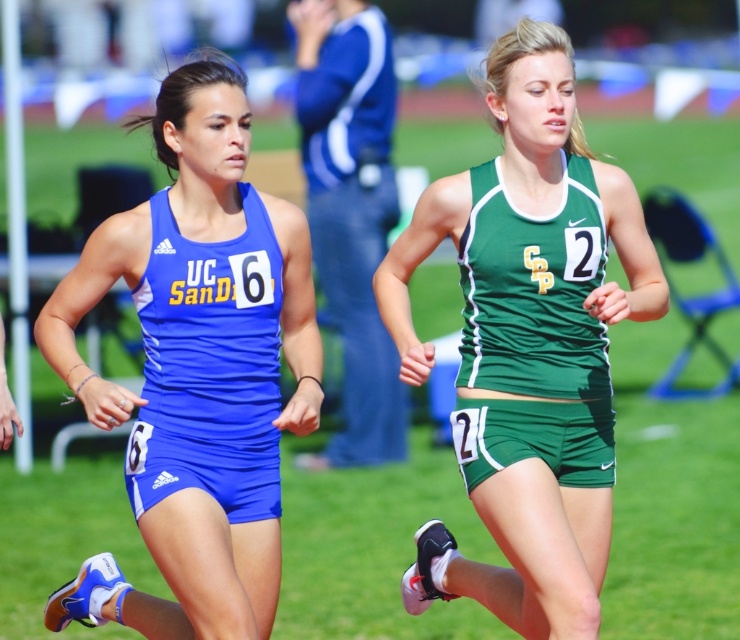
You are a photographer at the track event. You want to capture a photo that includes both the matte blue uniform at left and the green fabric tank top at center. Based on their positions, which athlete should be positioned lower in the photo?

The matte blue uniform at left should be positioned lower in the photo because it is located below the green fabric tank top at center.

You are a photographer at a track and field event. You want to capture a photo of both the green matte tank top at center and the matte blue tank top at center. Based on their positions, which athlete should you focus on first to ensure both are in the frame?

The green matte tank top at center is positioned on the right side of the matte blue tank top at center. Therefore, you should focus on the matte blue tank top at center first to ensure both are in the frame since it is on the left and closer to the center, allowing the photographer to frame both effectively.

You are a sports analyst watching a track race between two athletes. You notice the green matte tank top at center and the matte blue tank top at center. Based on the distance between them, can you estimate whether the athlete in the green matte tank top is ahead or behind the athlete in the matte blue tank top?

The distance between the green matte tank top at center and the matte blue tank top at center is 36.44 inches. Since the athlete in the green matte tank top is positioned further ahead in the race, they are ahead of the athlete in the matte blue tank top.